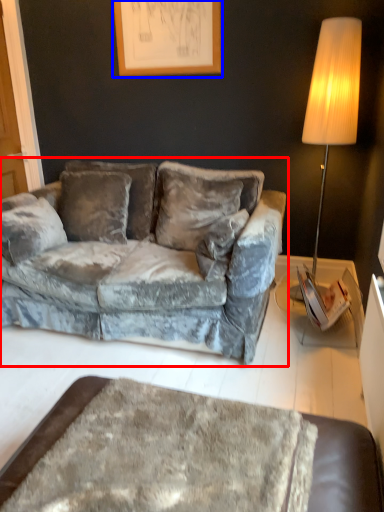
Question: Which object is further to the camera taking this photo, studio couch (highlighted by a red box) or picture frame (highlighted by a blue box)?

Choices:
 (A) studio couch
 (B) picture frame

Answer: (B)